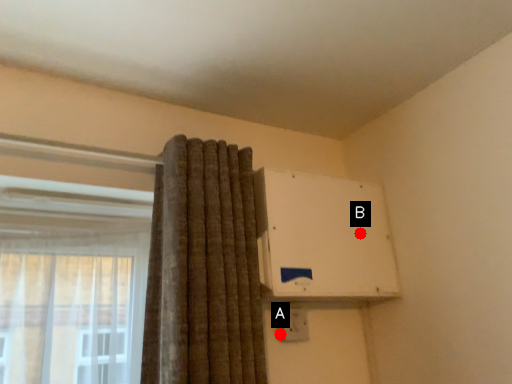
Question: Two points are circled on the image, labeled by A and B beside each circle. Among these points, which one is farthest from the camera?

Choices:
 (A) A is further
 (B) B is further

Answer: (B)